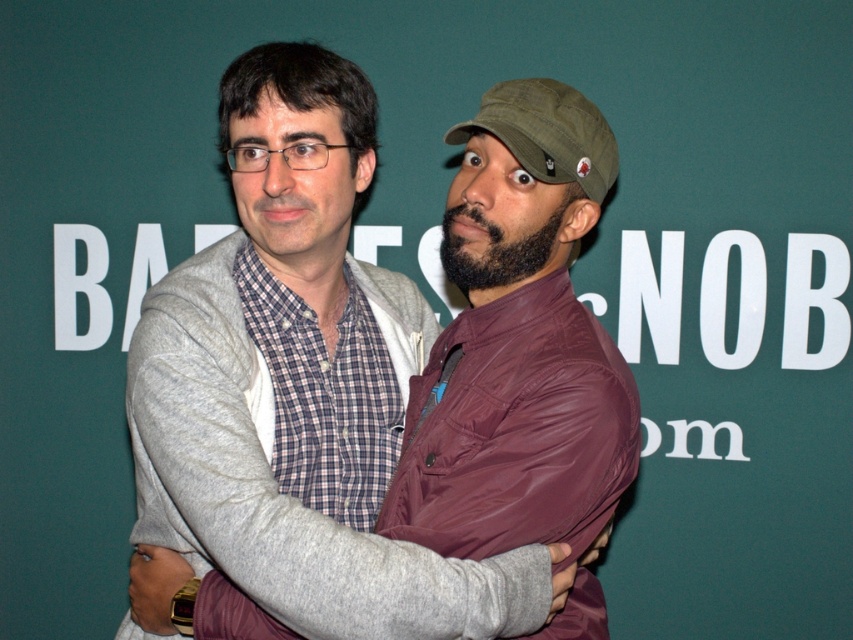
You are a photographer adjusting the focus on your camera. You want to ensure both the matte gray hoodie at center and the green fabric baseball cap at upper right are in sharp focus. Given that your camera has a depth of field range of 6 inches, will both objects be in focus?

The matte gray hoodie at center is 7.28 inches away from the green fabric baseball cap at upper right. Since the distance between them exceeds the camera s 6 inch depth of field range, only one of the objects will be in focus at a time.